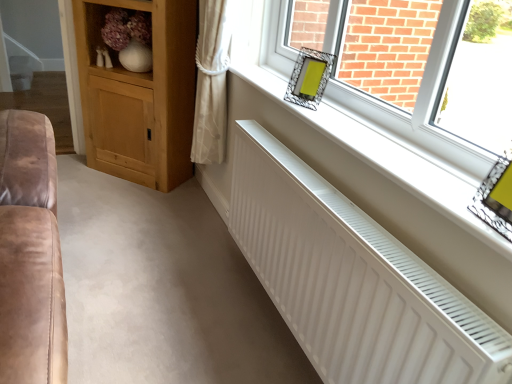
Question: Does wooden shelf at upper left appear on the right side of white matte radiator at lower center?

Choices:
 (A) yes
 (B) no

Answer: (B)

Question: Is wooden shelf at upper left wider than white matte radiator at lower center?

Choices:
 (A) no
 (B) yes

Answer: (B)

Question: Does wooden shelf at upper left lie behind white matte radiator at lower center?

Choices:
 (A) no
 (B) yes

Answer: (B)

Question: From the image's perspective, is wooden shelf at upper left beneath white matte radiator at lower center?

Choices:
 (A) yes
 (B) no

Answer: (B)

Question: Would you say white matte radiator at lower center is part of wooden shelf at upper left's contents?

Choices:
 (A) yes
 (B) no

Answer: (B)

Question: From a real-world perspective, does wooden shelf at upper left stand above white matte radiator at lower center?

Choices:
 (A) yes
 (B) no

Answer: (A)

Question: From the image's perspective, is wooden shelf at upper left located above metallic silver frame at upper right, arranged as the second picture frame when viewed from the top?

Choices:
 (A) yes
 (B) no

Answer: (A)

Question: Is metallic silver frame at upper right, arranged as the 2th picture frame when viewed from the left, inside wooden shelf at upper left?

Choices:
 (A) no
 (B) yes

Answer: (A)

Question: Does wooden shelf at upper left have a smaller size compared to metallic silver frame at upper right, arranged as the 2th picture frame when viewed from the left?

Choices:
 (A) yes
 (B) no

Answer: (B)

Question: Could you tell me if wooden shelf at upper left is turned towards metallic silver frame at upper right, the 2th picture frame viewed from the back?

Choices:
 (A) yes
 (B) no

Answer: (B)

Question: From a real-world perspective, is wooden shelf at upper left positioned under metallic silver frame at upper right, marked as the first picture frame in a bottom-to-top arrangement, based on gravity?

Choices:
 (A) no
 (B) yes

Answer: (B)

Question: Does wooden shelf at upper left have a greater width compared to metallic silver frame at upper right, arranged as the 2th picture frame when viewed from the left?

Choices:
 (A) no
 (B) yes

Answer: (B)

Question: Is metallic silver frame at upper right, the first picture frame from the right, behind white matte radiator at lower center?

Choices:
 (A) no
 (B) yes

Answer: (A)